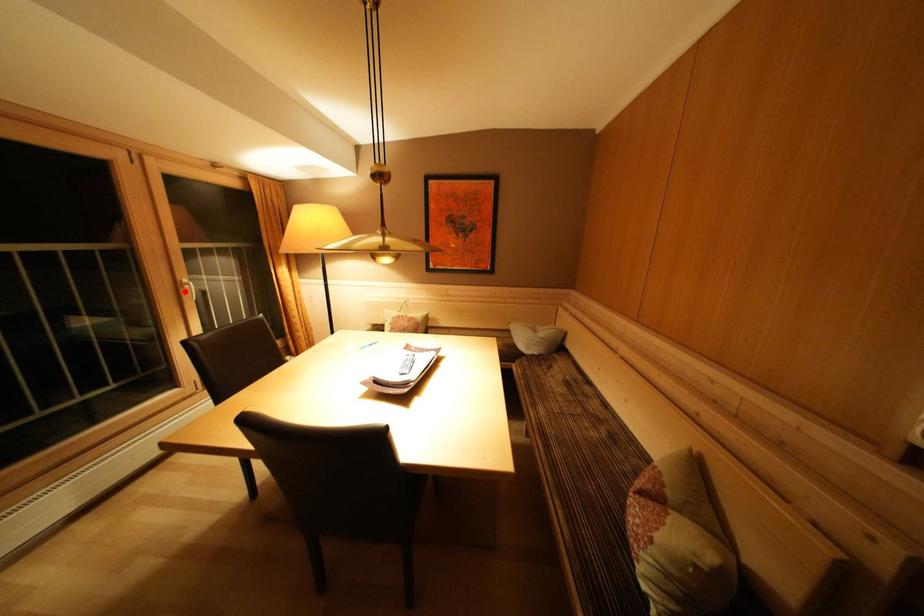
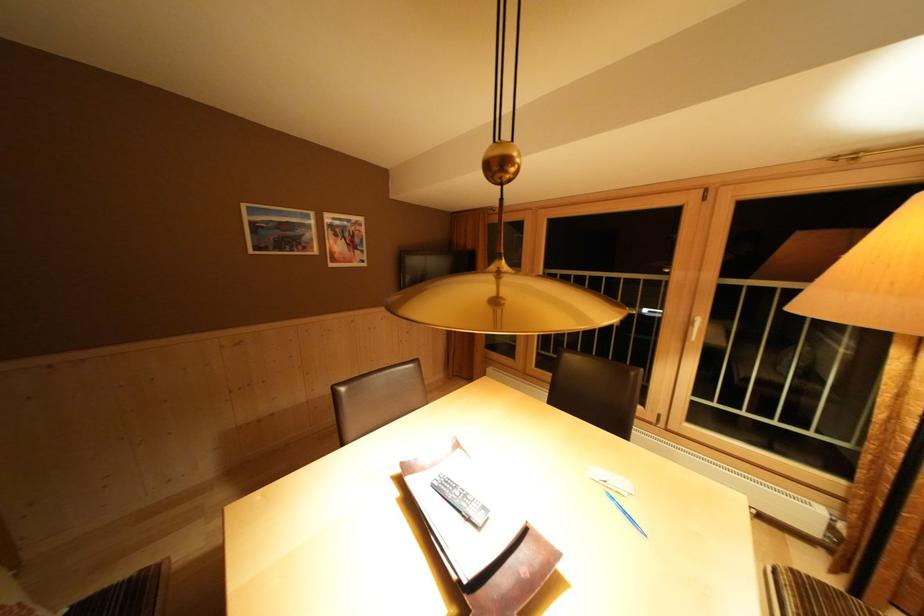
In the second image, find the point that corresponds to the highlighted location in the first image.

(697, 328)